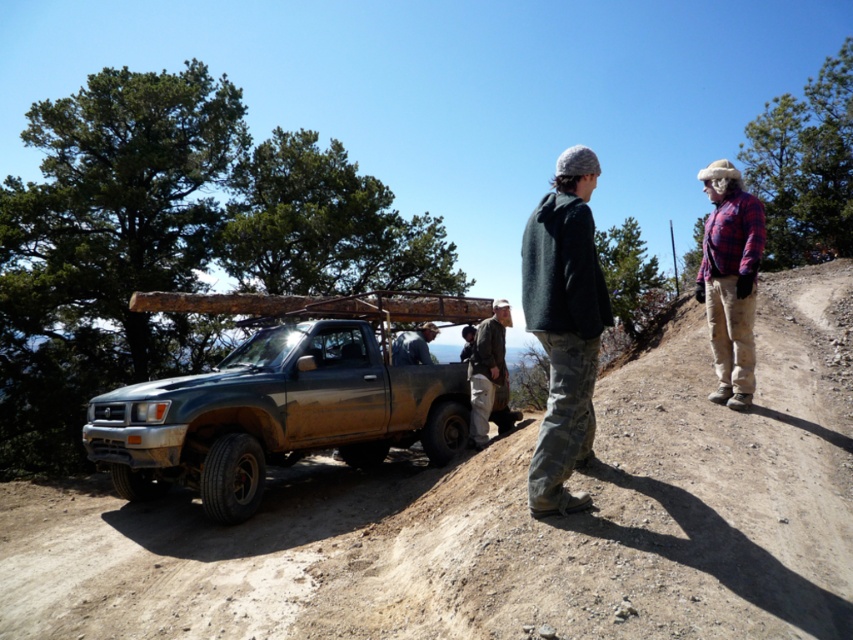
Measure the distance between point [283,371] and camera.

Point [283,371] and camera are 6.86 meters apart.

In the scene shown: Does dirty metallic pickup truck at center come behind brown canvas jacket at center?

That is False.

Locate an element on the screen. dirty metallic pickup truck at center is located at coordinates (282, 397).

Is point (824, 481) more distant than point (581, 298)?

That is True.

Which is in front, point (740, 497) or point (590, 387)?

Point (590, 387) is in front.

Image resolution: width=853 pixels, height=640 pixels. I want to click on brown dirt track at lower center, so click(500, 518).

Between point (694, 464) and point (491, 362), which one is positioned behind?

The point (491, 362) is more distant.

In the scene shown: Who is lower down, brown dirt track at lower center or brown canvas jacket at center?

brown dirt track at lower center is lower down.

Does point (697, 554) come in front of point (496, 339)?

Yes, it is.

Identify the location of brown dirt track at lower center. (500, 518).